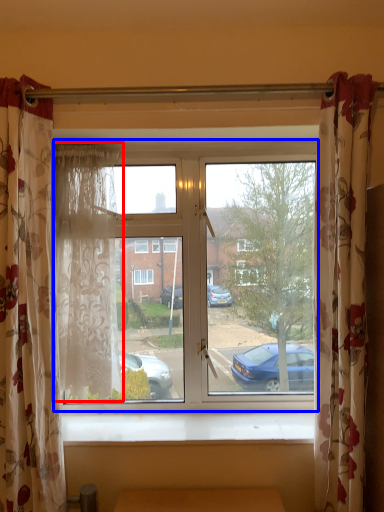
Question: Which object is further to the camera taking this photo, curtain (highlighted by a red box) or window (highlighted by a blue box)?

Choices:
 (A) curtain
 (B) window

Answer: (B)